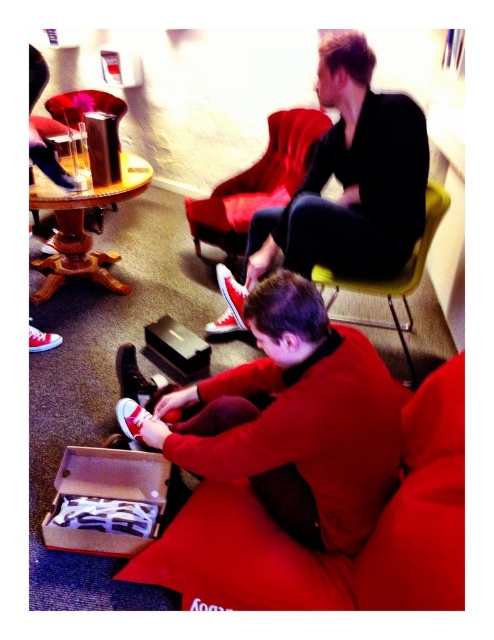
Who is more forward, (125, 381) or (66, 180)?

Point (125, 381) is more forward.

The width and height of the screenshot is (494, 640). In order to click on shiny black shoe at lower center in this screenshot , I will do `click(133, 378)`.

Which is more to the right, matte black shirt at upper center or shiny red canvas shoe at center?

From the viewer's perspective, matte black shirt at upper center appears more on the right side.

Does matte black shirt at upper center have a larger size compared to shiny red canvas shoe at center?

Indeed, matte black shirt at upper center has a larger size compared to shiny red canvas shoe at center.

Does point (365, 120) lie in front of point (237, 310)?

Yes, point (365, 120) is closer to viewer.

I want to click on matte black shirt at upper center, so click(351, 179).

Can you confirm if velvet red couch at lower center is thinner than yellow fabric armchair at center?

No, velvet red couch at lower center is not thinner than yellow fabric armchair at center.

Does point (269, 579) lie behind point (440, 209)?

No.

Where is `velvet red couch at lower center`? The height and width of the screenshot is (640, 494). velvet red couch at lower center is located at coordinates (327, 556).